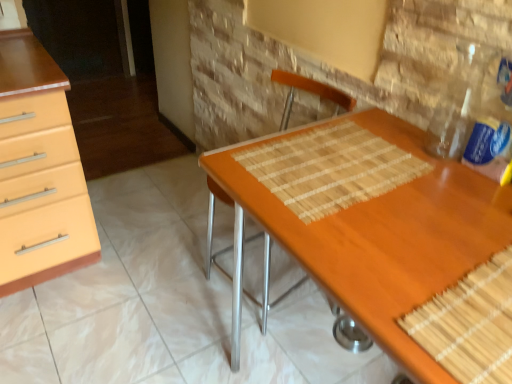
The height and width of the screenshot is (384, 512). In order to click on blank area to the left of orange woven fabric chair at center in this screenshot , I will do `click(162, 283)`.